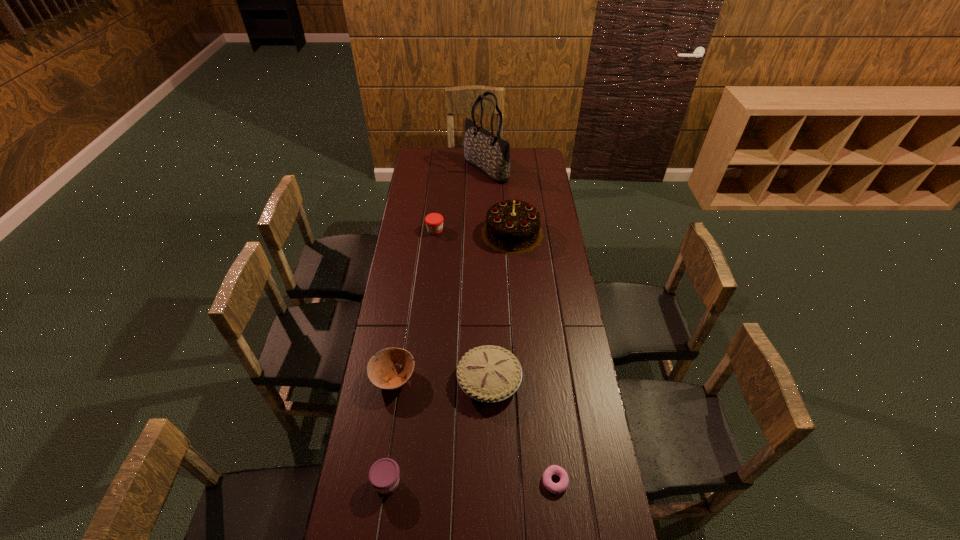
Where is `vacant position located on the back of the pie`? Image resolution: width=960 pixels, height=540 pixels. vacant position located on the back of the pie is located at coordinates (489, 319).

This screenshot has height=540, width=960. Find the location of `vacant space situated on the right of the bowl`. vacant space situated on the right of the bowl is located at coordinates (484, 378).

The image size is (960, 540). What are the coordinates of `free region located on the label side of the farther jam` in the screenshot? It's located at (520, 230).

I want to click on free space located on the front label of the nearer jam, so click(x=381, y=527).

Locate an element on the screen. vacant region located on the back of the pastry is located at coordinates (551, 446).

Find the location of a particular element. Image resolution: width=960 pixels, height=540 pixels. object present at the far edge is located at coordinates (485, 151).

Identify the location of bowl present at the left edge. (380, 373).

Identify the location of birthday cake at the right edge. This screenshot has width=960, height=540. (512, 227).

You are a GUI agent. You are given a task and a screenshot of the screen. Output one action in this format:
    pyautogui.click(x=<x>, y=<y>)
    Task: Click on the pastry located in the right edge section of the desktop
    
    Given the screenshot: What is the action you would take?
    pyautogui.click(x=561, y=486)

Where is `vacant point at the far edge`? The image size is (960, 540). vacant point at the far edge is located at coordinates (518, 163).